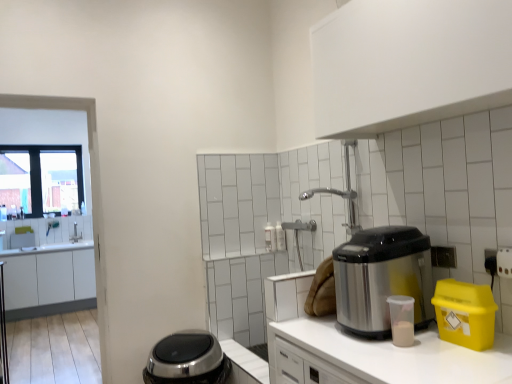
This screenshot has height=384, width=512. In order to click on free space above satin silver appliance at lower center, marked as the 2th appliance in a right-to-left arrangement (from a real-world perspective) in this screenshot , I will do `click(189, 339)`.